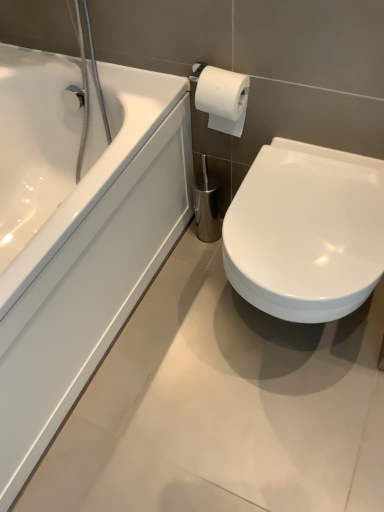
Locate an element on the screen. vacant space to the left of white glossy toilet at lower right is located at coordinates 175,336.